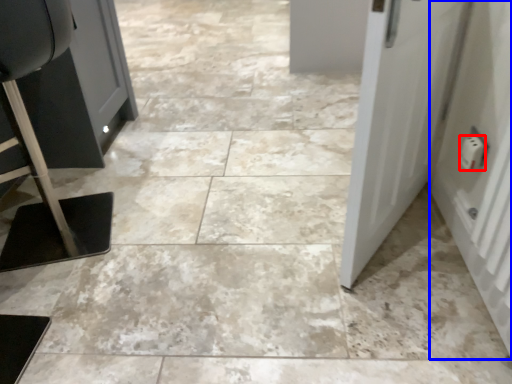
Question: Which of the following is the farthest to the observer, electric outlet (highlighted by a red box) or door (highlighted by a blue box)?

Choices:
 (A) electric outlet
 (B) door

Answer: (A)